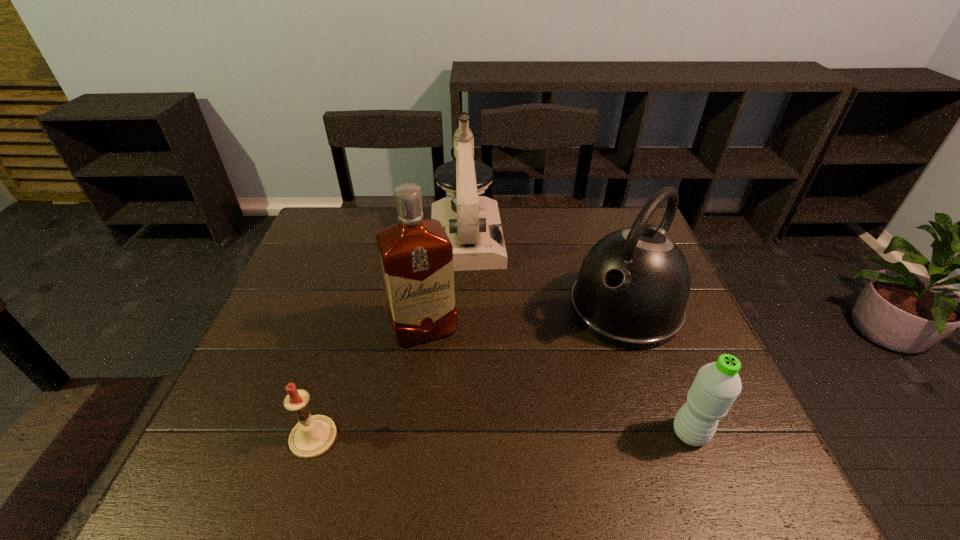
Locate an element on the screen. This screenshot has width=960, height=540. water bottle that is at the right edge is located at coordinates (716, 386).

This screenshot has height=540, width=960. What are the coordinates of `kettle at the right edge` in the screenshot? It's located at (633, 286).

Find the location of `object located in the near right corner section of the desktop`. object located in the near right corner section of the desktop is located at coordinates (716, 386).

At what (x,y) coordinates should I click in order to perform the action: click on vacant region at the far edge of the desktop. Please return your answer as a coordinate pair (x, y). This screenshot has height=540, width=960. Looking at the image, I should click on (565, 231).

At what (x,y) coordinates should I click in order to perform the action: click on vacant region at the near edge of the desktop. Please return your answer as a coordinate pair (x, y). Looking at the image, I should click on (440, 423).

Image resolution: width=960 pixels, height=540 pixels. In the image, there is a desktop. What are the coordinates of `vacant region at the left edge` in the screenshot? It's located at (304, 329).

Image resolution: width=960 pixels, height=540 pixels. In the image, there is a desktop. Find the location of `vacant space at the far left corner`. vacant space at the far left corner is located at coordinates (354, 228).

Identify the location of vacant space at the far right corner of the desktop. (603, 206).

In the image, there is a desktop. At what (x,y) coordinates should I click in order to perform the action: click on vacant space at the near right corner. Please return your answer as a coordinate pair (x, y). The image size is (960, 540). Looking at the image, I should click on (673, 427).

Find the location of a particular element. The height and width of the screenshot is (540, 960). free point between the shortest object and the liquor is located at coordinates (369, 384).